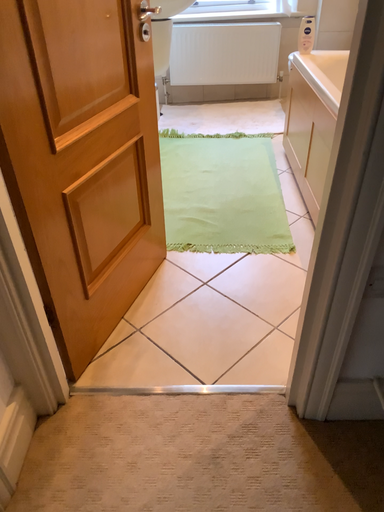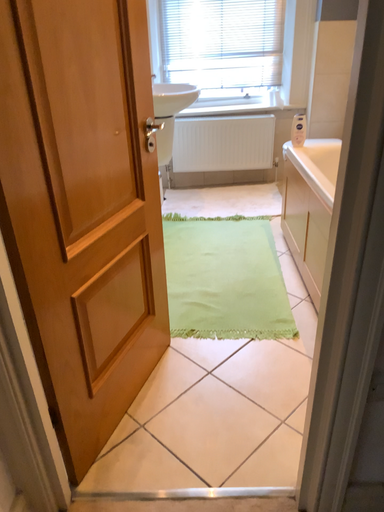
Question: How did the camera likely rotate when shooting the video?

Choices:
 (A) rotated upward
 (B) rotated downward

Answer: (A)